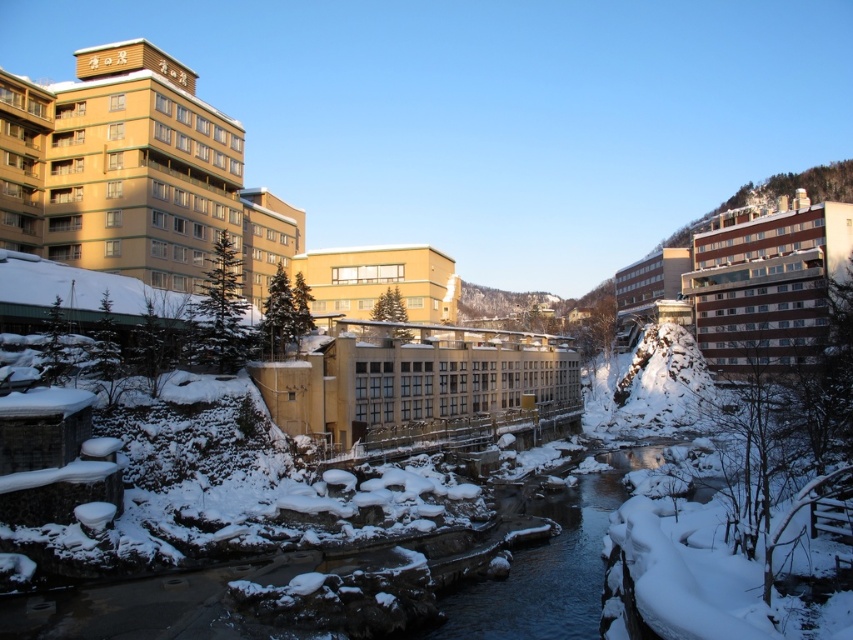
Question: Based on their relative distances, which object is farther from the beige concrete building at center?

Choices:
 (A) matte yellow building at center
 (B) matte beige building at upper right
 (C) white brick building at upper right

Answer: (B)

Question: Does matte yellow building at upper left appear on the right side of matte yellow building at center?

Choices:
 (A) yes
 (B) no

Answer: (B)

Question: Is beige concrete building at center wider than matte beige building at upper right?

Choices:
 (A) no
 (B) yes

Answer: (B)

Question: Which is nearer to the matte yellow building at upper left?

Choices:
 (A) white brick building at upper right
 (B) beige concrete building at center
 (C) matte yellow building at center

Answer: (C)

Question: Is matte yellow building at upper left positioned before beige concrete building at center?

Choices:
 (A) yes
 (B) no

Answer: (B)

Question: Which point is farther from the camera taking this photo?

Choices:
 (A) (706, 234)
 (B) (387, 348)
 (C) (44, 156)

Answer: (A)